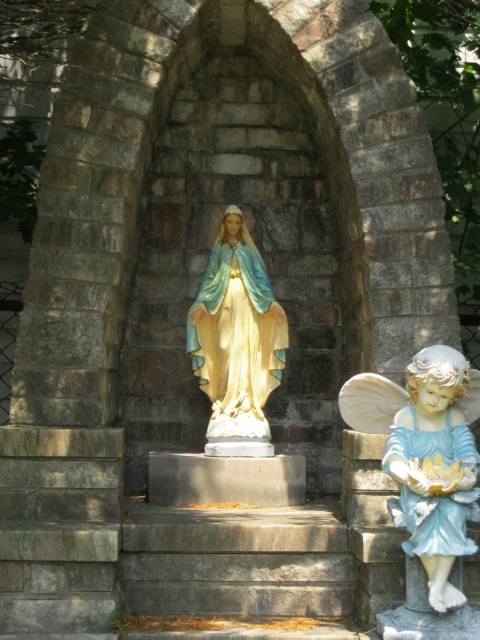
Locate an element on the screen. porcelain angel at right is located at coordinates (425, 456).

Is porcelain angel at right taller than matte gold statue at center?

Incorrect, porcelain angel at right's height is not larger of matte gold statue at center's.

Looking at this image, who is more forward, (x=399, y=420) or (x=263, y=376)?

Point (x=399, y=420)

Locate an element on the screen. porcelain angel at right is located at coordinates (425, 456).